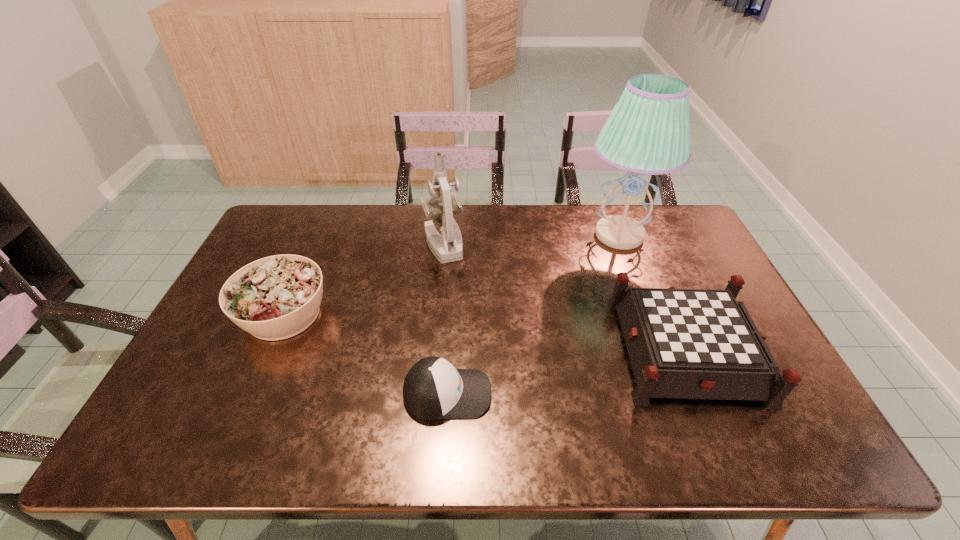
Where is `the closest object relative to the checkerboard`? The width and height of the screenshot is (960, 540). the closest object relative to the checkerboard is located at coordinates (648, 132).

Find the location of a particular element. The width and height of the screenshot is (960, 540). object that is the fourth closest to the microscope is located at coordinates (682, 343).

Identify the location of vacant region that satisfies the following two spatial constraints: 1. on the front side of the lamp; 2. on the left side of the checkerboard. (662, 349).